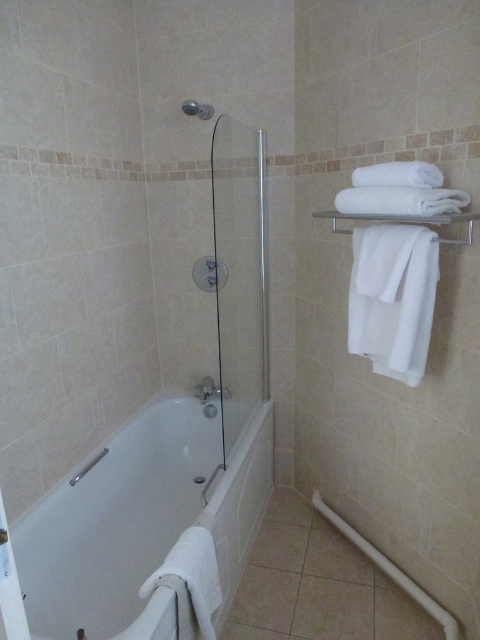
You are a person standing in the bathroom and want to reach the matte silver shower at upper center. Which direction should you move from the white glossy bathtub at center?

You should move to the right from the white glossy bathtub at center to reach the matte silver shower at upper center because the bathtub is to the left of the shower.

You are a plumber inspecting the bathroom and need to replace the shower head. You see the white glossy bathtub at center and the matte silver shower at upper center. Which object should you work on to replace the shower head?

The shower head is part of the matte silver shower at upper center, so you should work on the matte silver shower at upper center to replace the shower head.

You are a home inspector assessing the bathroom layout. You need to ensure that the clear glass shower door at center and the matte silver shower at upper center comply with safety regulations. According to the guidelines, the minimum distance between these two fixtures should be 24 inches. Is the current spacing between them sufficient?

The clear glass shower door at center is 23.77 inches from the matte silver shower at upper center. Since the required minimum distance is 24 inches, the current spacing is insufficient by 0.23 inches and does not comply with safety regulations.